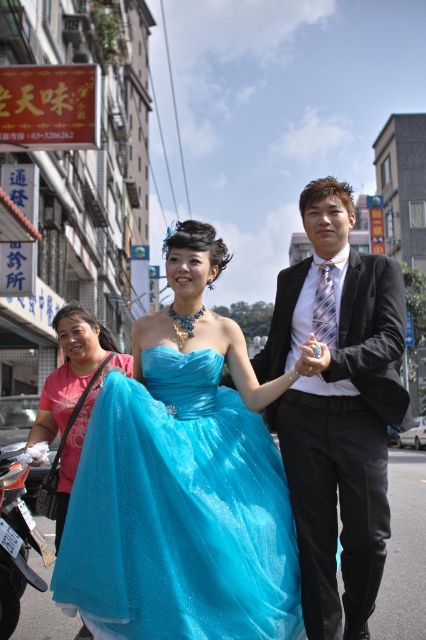
Question: Does shiny tulle dress at center lie behind black satin suit at center?

Choices:
 (A) no
 (B) yes

Answer: (A)

Question: Which point appears farthest from the camera in this image?

Choices:
 (A) (229, 518)
 (B) (60, 413)
 (C) (276, 308)
 (D) (383, 525)

Answer: (C)

Question: Which point appears farthest from the camera in this image?

Choices:
 (A) (158, 580)
 (B) (324, 568)

Answer: (B)

Question: Which point appears closest to the camera in this image?

Choices:
 (A) (350, 205)
 (B) (123, 580)
 (C) (86, 365)
 (D) (152, 582)

Answer: (B)

Question: Is turquoise satin dress at center above shiny blue dress at center?

Choices:
 (A) yes
 (B) no

Answer: (A)

Question: Does turquoise satin dress at center have a greater width compared to shiny tulle dress at center?

Choices:
 (A) yes
 (B) no

Answer: (A)